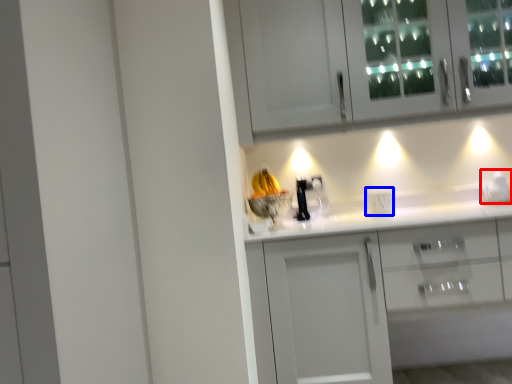
Question: Which point is further to the camera, appliance (highlighted by a red box) or electric outlet (highlighted by a blue box)?

Choices:
 (A) appliance
 (B) electric outlet

Answer: (B)